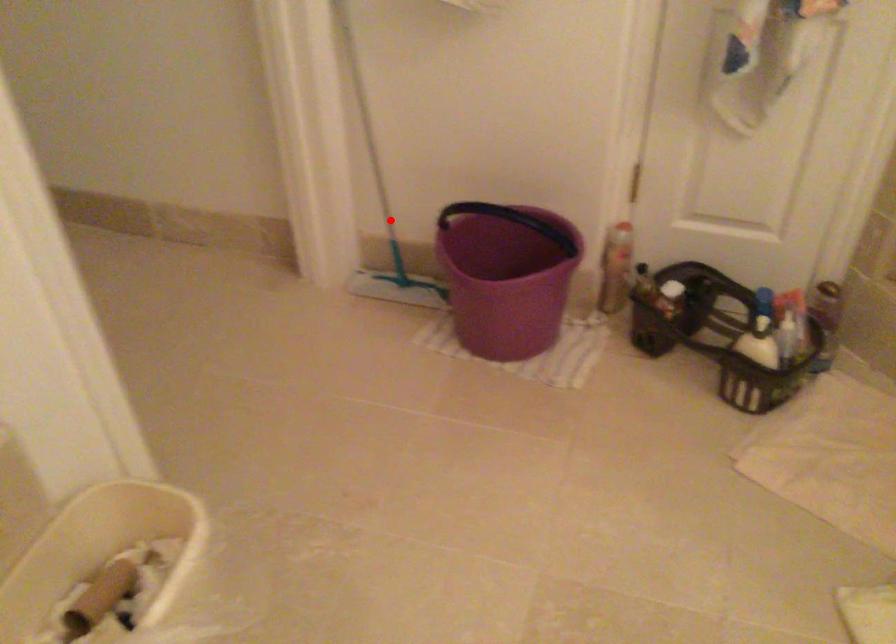
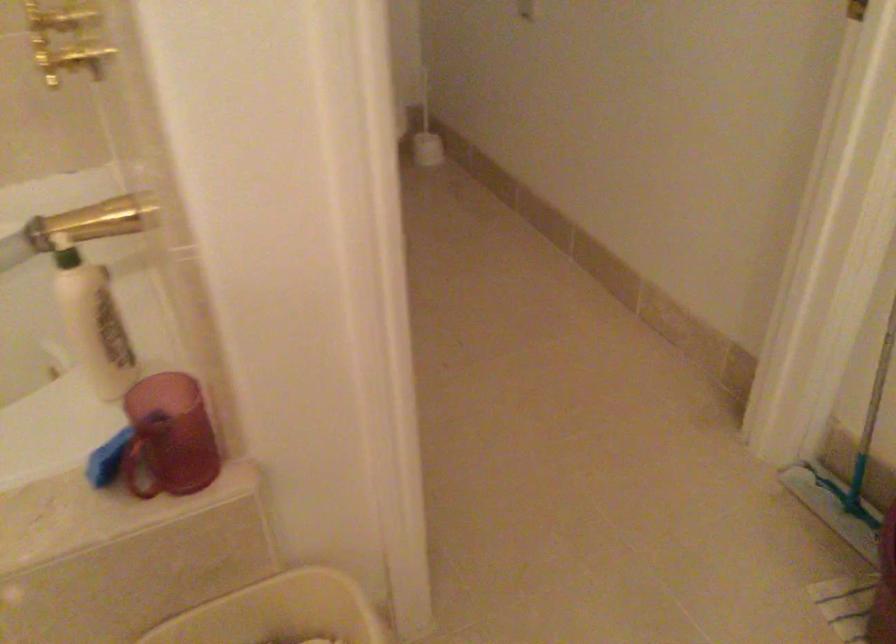
Find the pixel in the second image that matches the highlighted location in the first image.

(866, 431)